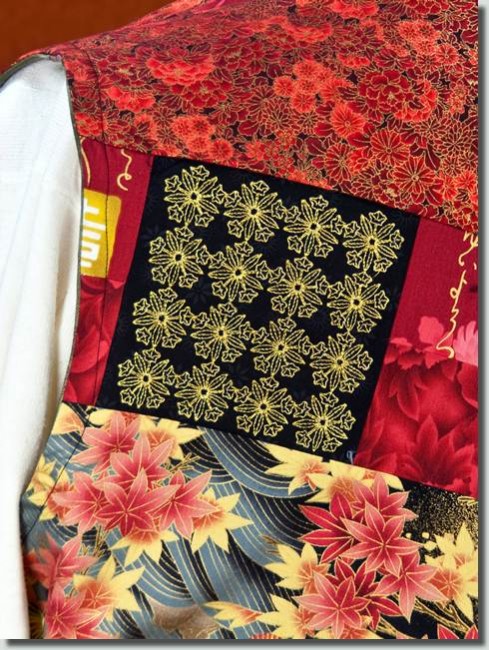
The image size is (489, 650). I want to click on top portion of pillowcase, so click(x=385, y=112).